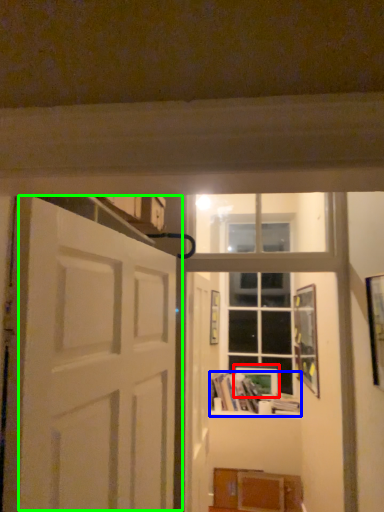
Question: Which is farther away from picture frame (highlighted by a red box)? book (highlighted by a blue box) or door (highlighted by a green box)?

Choices:
 (A) book
 (B) door

Answer: (B)